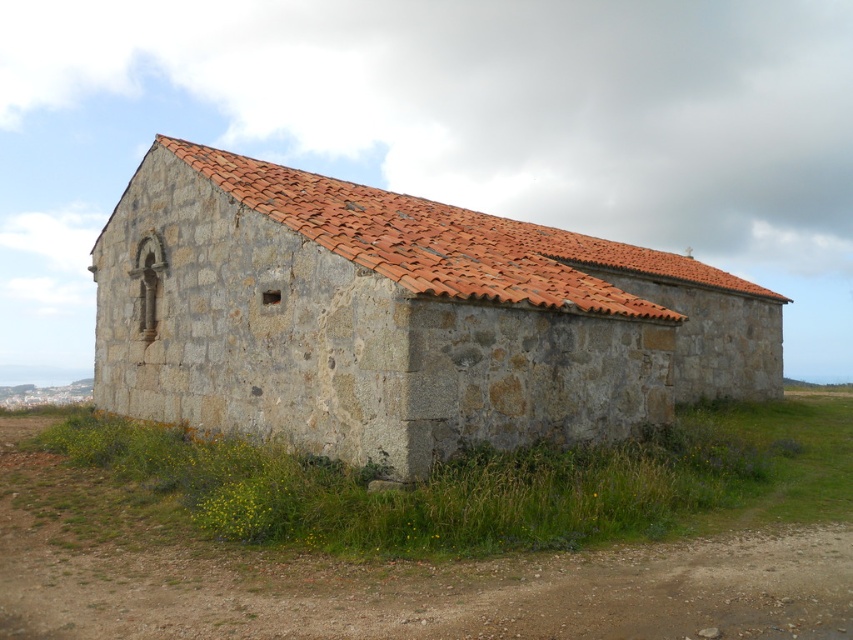
Between stone textured barn at center and red clay tiles at upper center, which one has more height?

stone textured barn at center

Can you confirm if stone textured barn at center is thinner than red clay tiles at upper center?

No, stone textured barn at center is not thinner than red clay tiles at upper center.

Describe the element at coordinates (399, 317) in the screenshot. I see `stone textured barn at center` at that location.

Image resolution: width=853 pixels, height=640 pixels. I want to click on stone textured barn at center, so click(x=399, y=317).

Who is shorter, stone textured barn at center or green grass at lower right?

With less height is green grass at lower right.

Is stone textured barn at center in front of green grass at lower right?

No, stone textured barn at center is behind green grass at lower right.

What do you see at coordinates (399, 317) in the screenshot?
I see `stone textured barn at center` at bounding box center [399, 317].

Locate an element on the screen. The width and height of the screenshot is (853, 640). stone textured barn at center is located at coordinates (399, 317).

Who is higher up, green grass at lower right or red clay tiles at upper center?

Positioned higher is red clay tiles at upper center.

Which is in front, point (769, 509) or point (560, 234)?

Point (769, 509) is more forward.

Identify the location of green grass at lower right. This screenshot has width=853, height=640. (418, 566).

At what (x,y) coordinates should I click in order to perform the action: click on green grass at lower right. Please return your answer as a coordinate pair (x, y). Looking at the image, I should click on (418, 566).